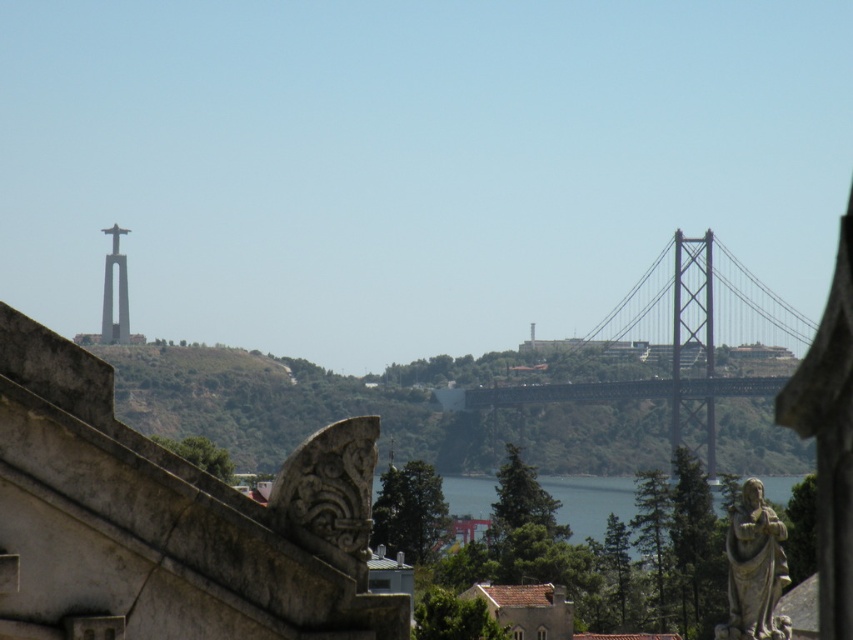
Question: Which point appears farthest from the camera in this image?

Choices:
 (A) (772, 628)
 (B) (735, 339)

Answer: (B)

Question: Does metallic bridge at center have a greater width compared to blue water at center?

Choices:
 (A) no
 (B) yes

Answer: (A)

Question: Can you confirm if stone statue at lower right is smaller than blue water at center?

Choices:
 (A) no
 (B) yes

Answer: (B)

Question: Does metallic bridge at center have a greater width compared to stone statue at lower right?

Choices:
 (A) yes
 (B) no

Answer: (A)

Question: Which object is positioned farthest from the stone statue at lower right?

Choices:
 (A) blue water at center
 (B) metallic bridge at center

Answer: (B)

Question: Which object appears closest to the camera in this image?

Choices:
 (A) blue water at center
 (B) metallic bridge at center
 (C) stone statue at lower right

Answer: (A)